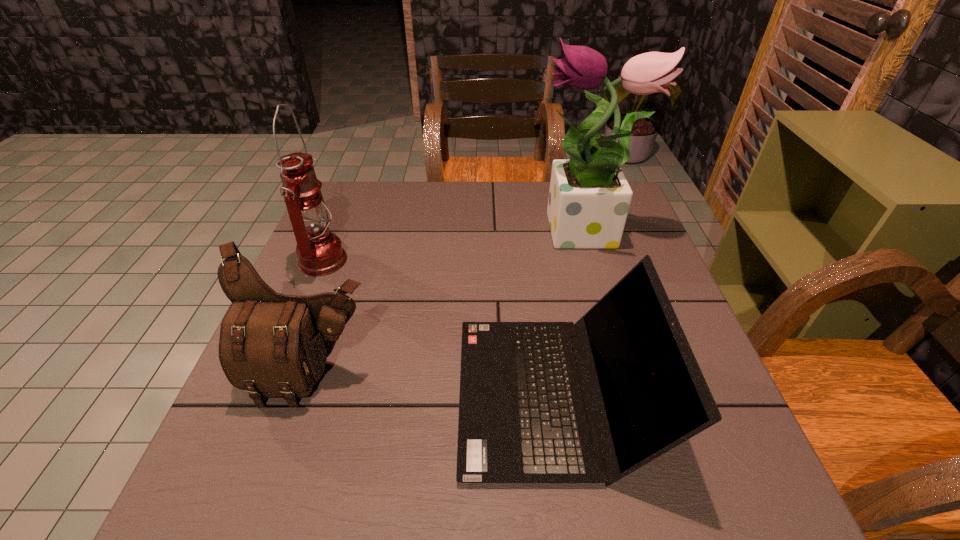
Image resolution: width=960 pixels, height=540 pixels. Identify the location of vacant space at the far edge. (383, 217).

Identify the location of vacant space at the left edge. The image size is (960, 540). (350, 248).

You are a GUI agent. You are given a task and a screenshot of the screen. Output one action in this format:
    pyautogui.click(x=<x>, y=<y>)
    Task: Click on the vacant region at the right edge of the desktop
    
    Given the screenshot: What is the action you would take?
    pyautogui.click(x=611, y=276)

The width and height of the screenshot is (960, 540). In order to click on free space at the far left corner in this screenshot , I will do `click(348, 192)`.

In the image, there is a desktop. Where is `vacant space at the near left corner`? This screenshot has height=540, width=960. vacant space at the near left corner is located at coordinates (290, 494).

The width and height of the screenshot is (960, 540). What are the coordinates of `vacant space at the near right corner of the desktop` in the screenshot? It's located at pyautogui.click(x=708, y=511).

Locate an element on the screen. The height and width of the screenshot is (540, 960). vacant region between the third tallest object and the flower arrangement is located at coordinates (449, 305).

Find the location of a particular element. This screenshot has width=960, height=540. vacant point located between the tallest object and the laptop computer is located at coordinates (570, 314).

You are a GUI agent. You are given a task and a screenshot of the screen. Output one action in this format:
    pyautogui.click(x=<x>, y=<y>)
    Task: Click on the empty location between the shortest object and the flower arrangement
    
    Given the screenshot: What is the action you would take?
    (x=570, y=314)

The width and height of the screenshot is (960, 540). What are the coordinates of `empty space between the shoulder bag and the shortest object` in the screenshot? It's located at [x=433, y=385].